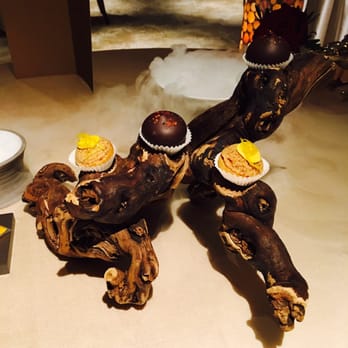
Identify the location of gray object in background to the right of the lamp. The image size is (348, 348). (334, 21).